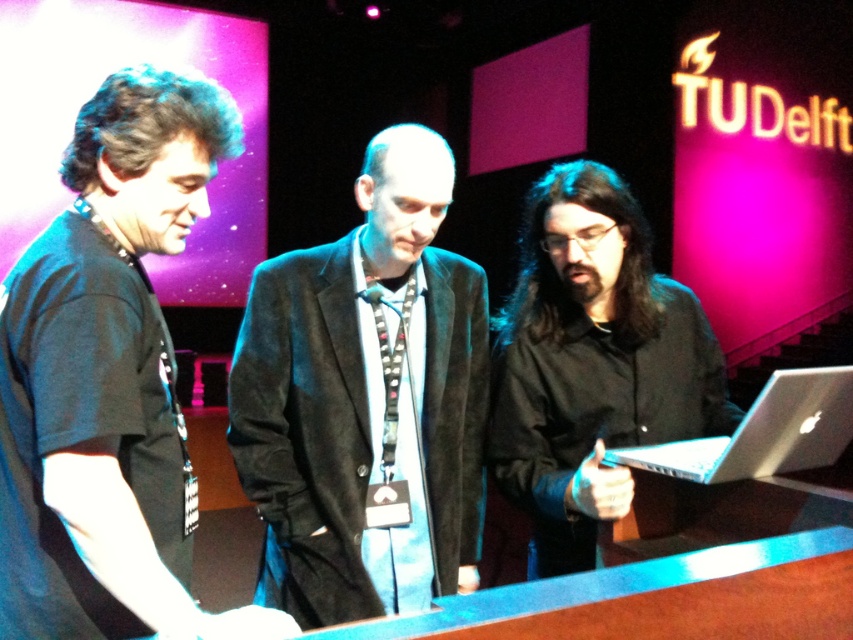
Question: Which object appears closest to the camera in this image?

Choices:
 (A) black matte shirt at center
 (B) black suede jacket at center

Answer: (A)

Question: Considering the relative positions of black matte shirt at left and silver metallic laptop at center in the image provided, where is black matte shirt at left located with respect to silver metallic laptop at center?

Choices:
 (A) above
 (B) below

Answer: (A)

Question: Is black matte shirt at left bigger than black suede jacket at center?

Choices:
 (A) yes
 (B) no

Answer: (B)

Question: Is black suede jacket at center wider than silver metallic laptop at center?

Choices:
 (A) yes
 (B) no

Answer: (A)

Question: Which of the following is the farthest from the observer?

Choices:
 (A) (521, 381)
 (B) (143, 188)

Answer: (A)

Question: Which of these objects is positioned farthest from the silver metallic laptop at center?

Choices:
 (A) black matte shirt at left
 (B) black matte shirt at center

Answer: (A)